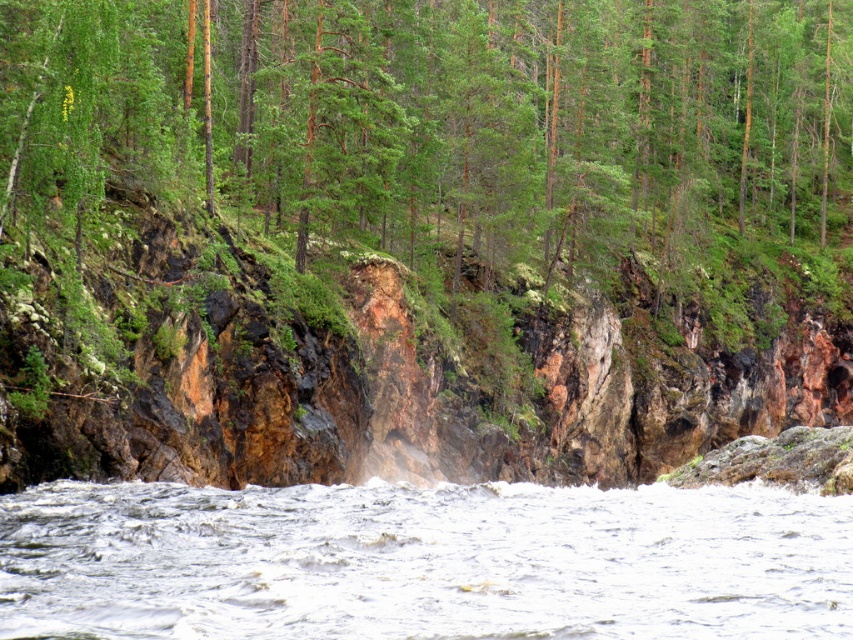
Question: Is rusty rock cliff at center smaller than white frothy water at center?

Choices:
 (A) no
 (B) yes

Answer: (A)

Question: Which object is closer to the camera taking this photo?

Choices:
 (A) white frothy water at center
 (B) rusty rock cliff at center
 (C) green matte rock at center

Answer: (A)

Question: Does rusty rock cliff at center appear over white frothy water at center?

Choices:
 (A) no
 (B) yes

Answer: (B)

Question: Does green matte rock at center appear under white frothy water at center?

Choices:
 (A) no
 (B) yes

Answer: (A)

Question: Which of the following is the closest to the observer?

Choices:
 (A) (85, 376)
 (B) (273, 68)

Answer: (A)

Question: Among these points, which one is farthest from the camera?

Choices:
 (A) pyautogui.click(x=634, y=577)
 (B) pyautogui.click(x=843, y=102)

Answer: (B)